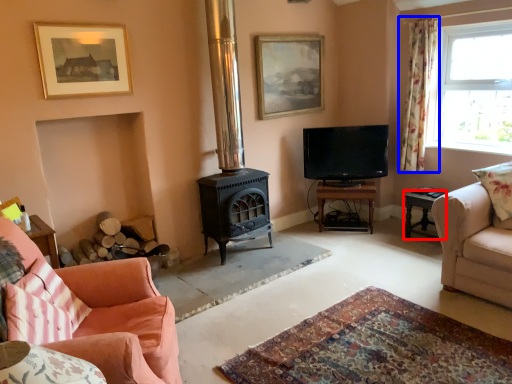
Question: Which object appears farthest to the camera in this image, table (highlighted by a red box) or curtain (highlighted by a blue box)?

Choices:
 (A) table
 (B) curtain

Answer: (B)